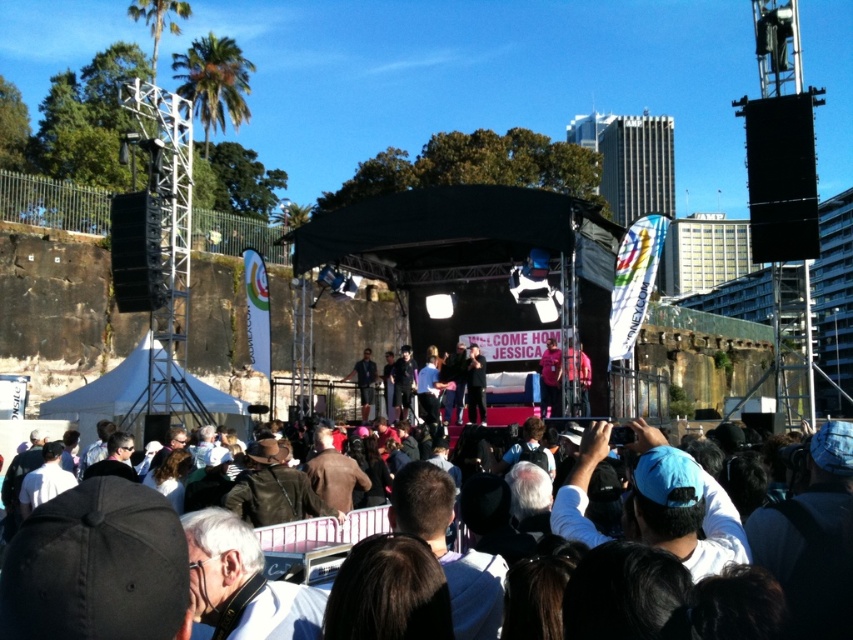
Who is higher up, dark brown leather jacket at center or pink fabric at stage center?

pink fabric at stage center

Can you confirm if dark brown leather jacket at center is bigger than pink fabric at stage center?

Yes, dark brown leather jacket at center is bigger than pink fabric at stage center.

Who is more forward, (642, 470) or (556, 372)?

Point (642, 470)

Where is `dark brown leather jacket at center`? Image resolution: width=853 pixels, height=640 pixels. dark brown leather jacket at center is located at coordinates (831, 612).